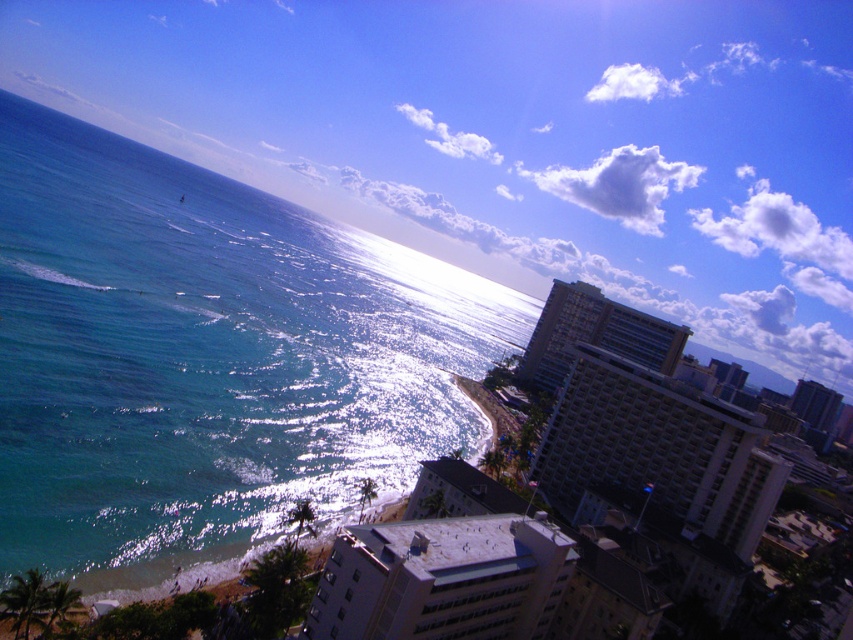
Does point (672, 508) lie behind point (567, 326)?

No, (672, 508) is closer to viewer.

The image size is (853, 640). Describe the element at coordinates (659, 449) in the screenshot. I see `white glossy building at center` at that location.

Is point (553, 444) behind point (669, 337)?

No, it is not.

This screenshot has width=853, height=640. Find the location of `white glossy building at center`. white glossy building at center is located at coordinates (659, 449).

Is the position of blue glossy water at left more distant than that of gray concrete building at center?

No, it is not.

Which is above, blue glossy water at left or gray concrete building at center?

Answer: blue glossy water at left is higher up.

The height and width of the screenshot is (640, 853). What are the coordinates of `blue glossy water at left` in the screenshot? It's located at point(207,358).

Does blue glossy water at left lie behind white glossy building at center?

No, it is not.

Is blue glossy water at left above white glossy building at center?

Indeed, blue glossy water at left is positioned over white glossy building at center.

What do you see at coordinates (207, 358) in the screenshot?
I see `blue glossy water at left` at bounding box center [207, 358].

This screenshot has width=853, height=640. I want to click on blue glossy water at left, so click(x=207, y=358).